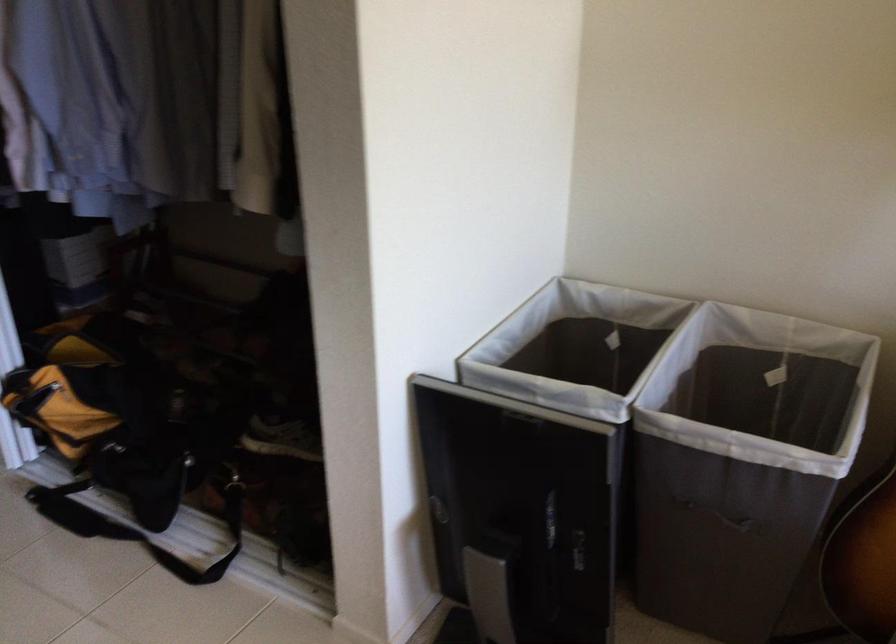
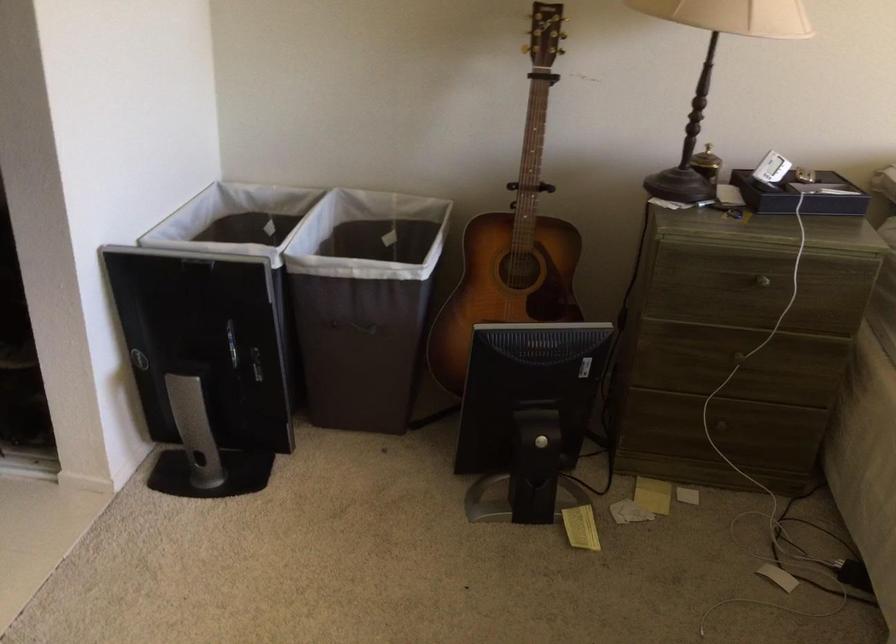
In the second image, find the point that corresponds to (574,346) in the first image.

(239, 241)